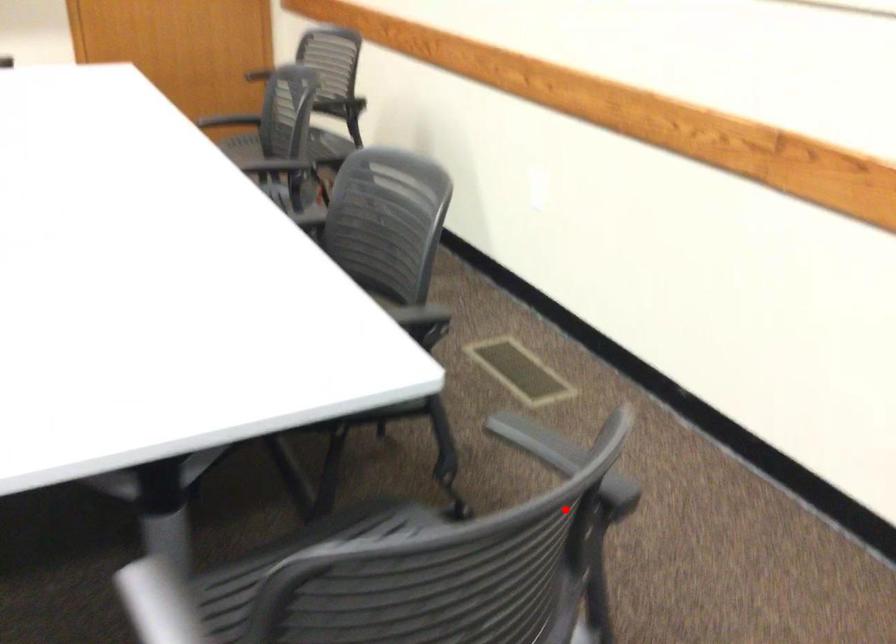
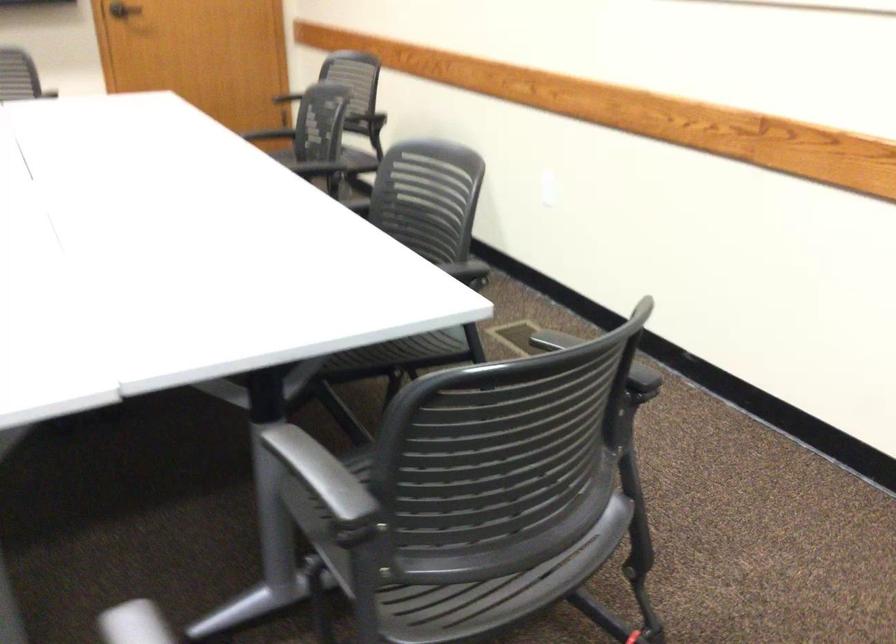
Where in the second image is the point corresponding to the highlighted location from the first image?

(598, 359)